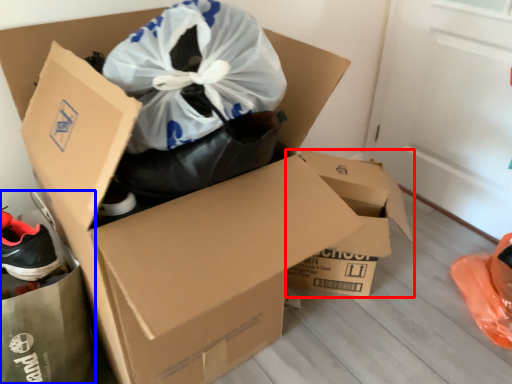
Question: Which object is further to the camera taking this photo, box (highlighted by a red box) or garbage (highlighted by a blue box)?

Choices:
 (A) box
 (B) garbage

Answer: (A)